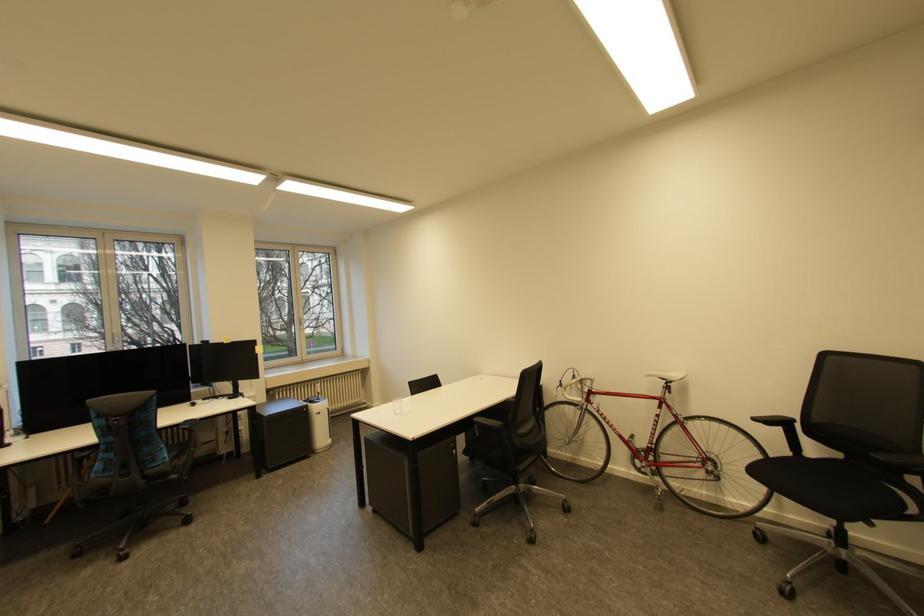
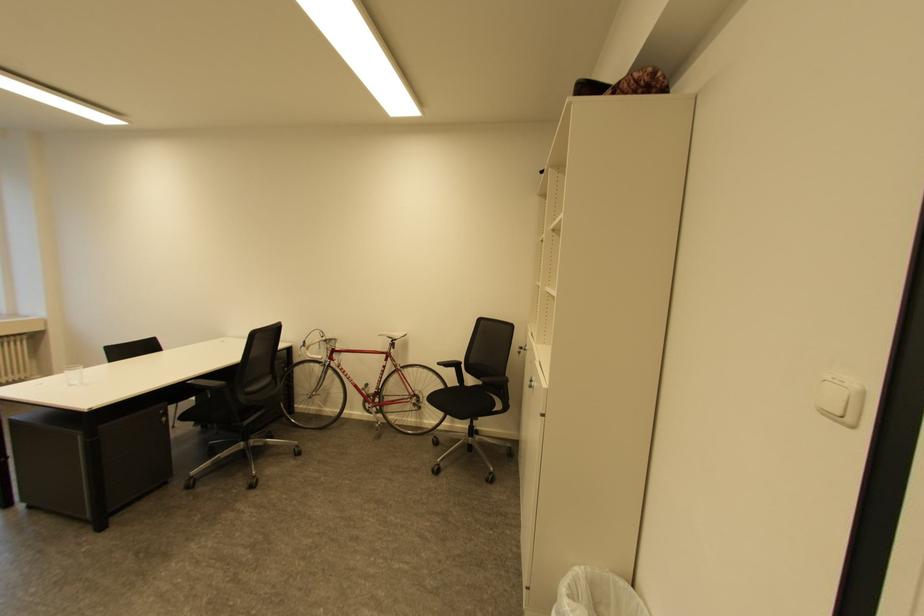
Find the pixel in the second image that matches point (566, 382) in the first image.

(311, 342)